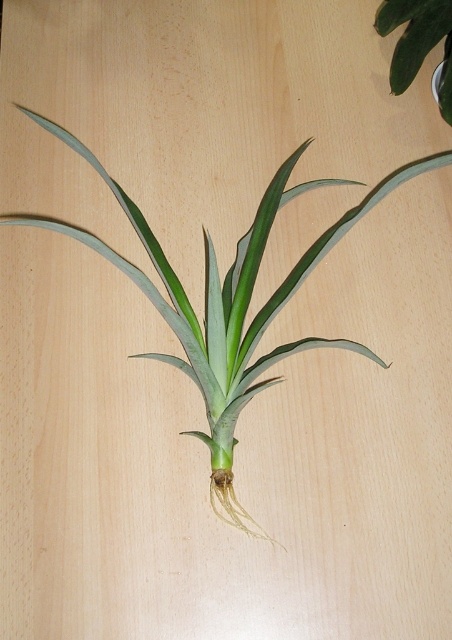
You are a gardener who needs to water two green leafy plants. You have a watering can that can only reach 16 inches. The plants are the green leafy plant at center and the green leafy plant at upper right. Can you water both plants without moving the watering can?

The green leafy plant at center and green leafy plant at upper right are 15.94 inches apart. Since the watering can can reach 16 inches, you can water both plants without moving the watering can because the distance between them is within the reach of the watering can.

You are a gardener who needs to place a decorative stone exactly at the center of the wooden surface. The green leafy plant at center is currently occupying part of the center area. Can you determine if the stone can be placed at the exact center without overlapping the plant?

The green leafy plant at center is located at point (x=227, y=301), which is very close to the exact center of the wooden surface. Therefore, placing the stone at the exact center may overlap with the plant, so it might not be possible.